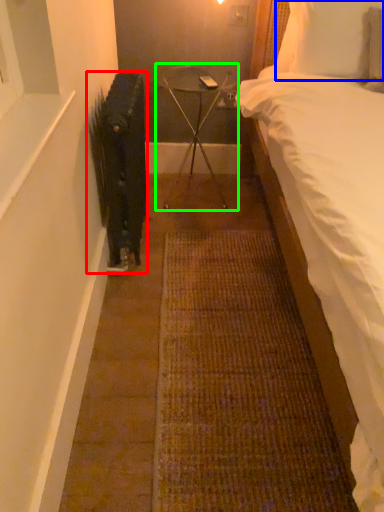
Question: Considering the real-world distances, which object is closest to radiator (highlighted by a red box)? pillow (highlighted by a blue box) or furniture (highlighted by a green box).

Choices:
 (A) pillow
 (B) furniture

Answer: (B)